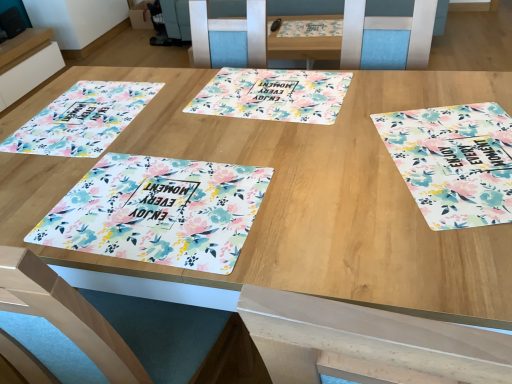
Find the location of a particular element. Image resolution: width=512 pixels, height=384 pixels. free location to the right of floral printed placemat at lower left, the 2th tablecloth when ordered from left to right is located at coordinates (323, 187).